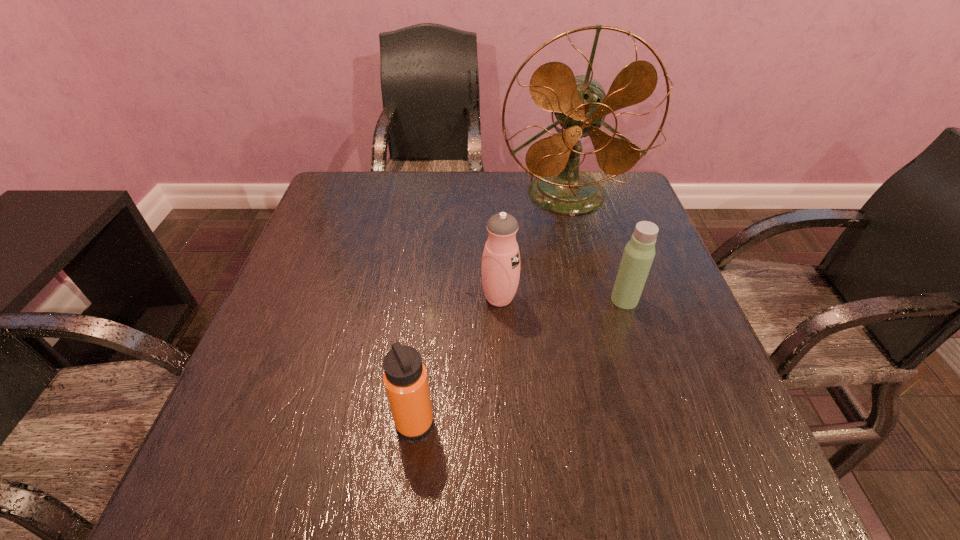
Identify the location of the tallest object. (580, 104).

The height and width of the screenshot is (540, 960). In order to click on fan in this screenshot , I will do tap(580, 104).

The image size is (960, 540). Identify the location of the second thermos bottle from right to left. (500, 267).

In order to click on the nearest object in this screenshot , I will do `click(405, 378)`.

The width and height of the screenshot is (960, 540). In order to click on the leftmost object in this screenshot , I will do `click(405, 378)`.

The image size is (960, 540). I want to click on the rightmost thermos bottle, so click(639, 252).

This screenshot has width=960, height=540. I want to click on vacant space situated in front of the fan, directing air flow, so click(x=590, y=288).

Locate an element on the screen. This screenshot has height=540, width=960. vacant space located on the back of the second thermos bottle from right to left is located at coordinates (497, 244).

Where is `free spot located on the right of the leftmost object`? This screenshot has height=540, width=960. free spot located on the right of the leftmost object is located at coordinates (469, 422).

This screenshot has height=540, width=960. In order to click on vacant space located 0.320m on the front of the rightmost thermos bottle in this screenshot , I will do `click(678, 464)`.